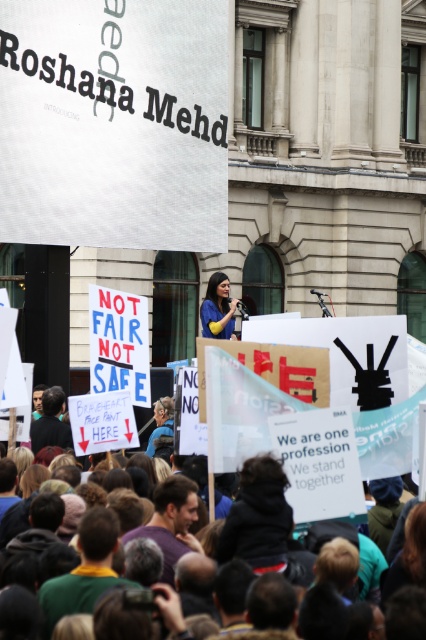
Question: Which of the following is the farthest from the observer?

Choices:
 (A) multicolored fabric crowd at center
 (B) matte blue shirt at center

Answer: (B)

Question: Can you confirm if multicolored fabric crowd at center is positioned to the left of matte blue shirt at center?

Choices:
 (A) yes
 (B) no

Answer: (B)

Question: Which point is farther to the camera?

Choices:
 (A) (328, 440)
 (B) (210, 282)

Answer: (B)

Question: Is multicolored fabric crowd at center wider than matte blue shirt at center?

Choices:
 (A) no
 (B) yes

Answer: (B)

Question: Can you confirm if multicolored fabric crowd at center is thinner than matte blue shirt at center?

Choices:
 (A) no
 (B) yes

Answer: (A)